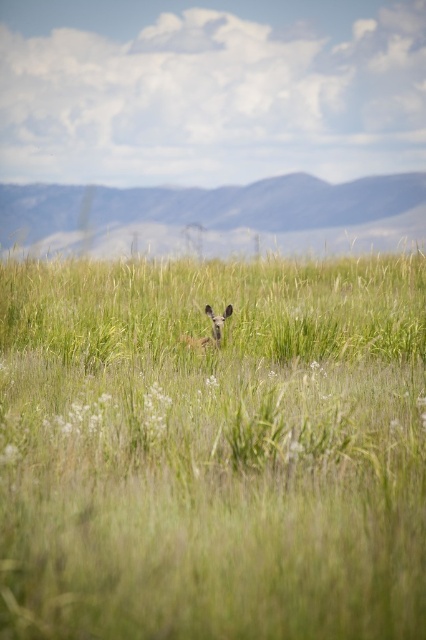
Does green grassy field at center have a greater height compared to brown furry deer at center?

Indeed, green grassy field at center has a greater height compared to brown furry deer at center.

The height and width of the screenshot is (640, 426). What do you see at coordinates (213, 449) in the screenshot?
I see `green grassy field at center` at bounding box center [213, 449].

This screenshot has width=426, height=640. What do you see at coordinates (213, 449) in the screenshot?
I see `green grassy field at center` at bounding box center [213, 449].

Find the location of `green grassy field at center`. green grassy field at center is located at coordinates (213, 449).